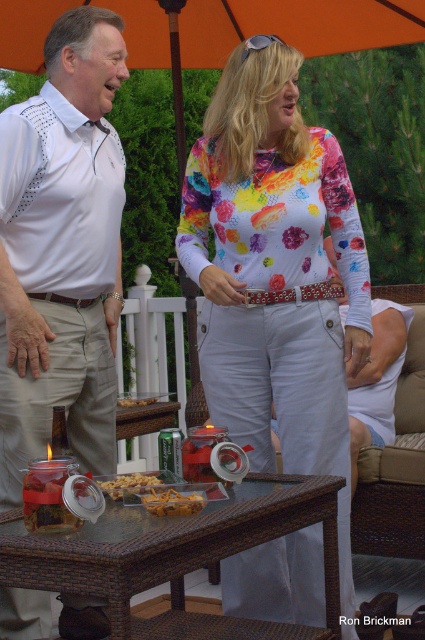
Question: Is brown wicker table at lower center below golden crumbly snack at center?

Choices:
 (A) yes
 (B) no

Answer: (A)

Question: Which of the following is the closest to the observer?

Choices:
 (A) golden crumbly snack at center
 (B) floral print blouse at center

Answer: (A)

Question: Which of the following is the closest to the observer?

Choices:
 (A) brown wicker table at lower center
 (B) golden crispy chips at center
 (C) floral print blouse at center

Answer: (A)

Question: Is floral print blouse at center above translucent plastic container at center?

Choices:
 (A) no
 (B) yes

Answer: (B)

Question: Does brown wicker table at lower center appear under translucent plastic container at center?

Choices:
 (A) yes
 (B) no

Answer: (A)

Question: Estimate the real-world distances between objects in this image. Which object is farther from the golden crumbly snack at center?

Choices:
 (A) translucent plastic container at center
 (B) brown wicker table at lower center
 (C) floral print blouse at center

Answer: (C)